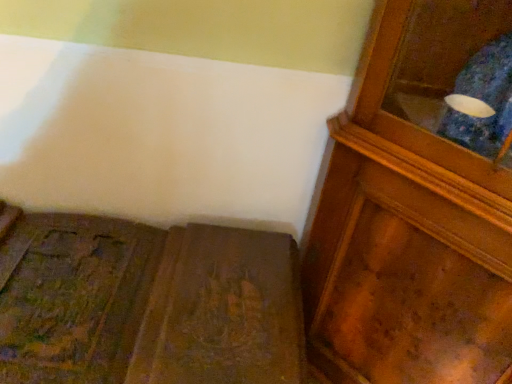
Describe the element at coordinates (146, 303) in the screenshot. The width and height of the screenshot is (512, 384). I see `wooden carved bench at lower left` at that location.

Image resolution: width=512 pixels, height=384 pixels. Find the location of `wooden carved bench at lower left`. wooden carved bench at lower left is located at coordinates point(146,303).

What do you see at coordinates (418, 204) in the screenshot? I see `wooden cabinet at right` at bounding box center [418, 204].

Where is `wooden cabinet at right`? This screenshot has width=512, height=384. wooden cabinet at right is located at coordinates (418, 204).

The width and height of the screenshot is (512, 384). In order to click on wooden carved bench at lower left in this screenshot , I will do `click(146, 303)`.

Considering the positions of objects wooden carved bench at lower left and wooden cabinet at right in the image provided, who is more to the right, wooden carved bench at lower left or wooden cabinet at right?

wooden cabinet at right is more to the right.

Between wooden carved bench at lower left and wooden cabinet at right, which one is positioned behind?

wooden carved bench at lower left is more distant.

Considering the points (148, 236) and (330, 355), which point is behind, point (148, 236) or point (330, 355)?

The point (330, 355) is behind.

From the image's perspective, is wooden carved bench at lower left located above wooden cabinet at right?

No, from the image's perspective, wooden carved bench at lower left is not above wooden cabinet at right.

From a real-world perspective, is wooden carved bench at lower left located beneath wooden cabinet at right?

Yes, from a real-world perspective, wooden carved bench at lower left is beneath wooden cabinet at right.

Between wooden carved bench at lower left and wooden cabinet at right, which one has smaller width?

With smaller width is wooden cabinet at right.

Is wooden carved bench at lower left taller or shorter than wooden cabinet at right?

In the image, wooden carved bench at lower left appears to be shorter than wooden cabinet at right.

Who is smaller, wooden carved bench at lower left or wooden cabinet at right?

Smaller between the two is wooden carved bench at lower left.

Do you think wooden carved bench at lower left is within wooden cabinet at right, or outside of it?

wooden carved bench at lower left is not enclosed by wooden cabinet at right.

Is wooden carved bench at lower left placed right next to wooden cabinet at right?

No, wooden carved bench at lower left is not beside wooden cabinet at right.

Is wooden carved bench at lower left positioned with its back to wooden cabinet at right?

wooden carved bench at lower left is not turned away from wooden cabinet at right.

What's the angular difference between wooden carved bench at lower left and wooden cabinet at right's facing directions?

The facing directions of wooden carved bench at lower left and wooden cabinet at right are 44.8 degrees apart.

How much distance is there between wooden carved bench at lower left and wooden cabinet at right?

The distance of wooden carved bench at lower left from wooden cabinet at right is 35.90 centimeters.

Find the location of `cupboard located above the wooden carved bench at lower left (from a real-world perspective)`. cupboard located above the wooden carved bench at lower left (from a real-world perspective) is located at coordinates (418, 204).

Between wooden cabinet at right and wooden carved bench at lower left, which one appears on the left side from the viewer's perspective?

wooden carved bench at lower left is more to the left.

Looking at this image, is wooden cabinet at right behind wooden carved bench at lower left?

No, the depth of wooden cabinet at right is less than that of wooden carved bench at lower left.

Which point is more forward, (x=464, y=318) or (x=227, y=231)?

The point (x=464, y=318) is closer.

From the image's perspective, is wooden cabinet at right above wooden carved bench at lower left?

Correct, wooden cabinet at right appears higher than wooden carved bench at lower left in the image.

From a real-world perspective, between wooden cabinet at right and wooden carved bench at lower left, who is vertically higher?

In real-world perspective, wooden cabinet at right is above.

Is wooden cabinet at right thinner than wooden carved bench at lower left?

Yes, wooden cabinet at right is thinner than wooden carved bench at lower left.

From their relative heights in the image, would you say wooden cabinet at right is taller or shorter than wooden carved bench at lower left?

Considering their sizes, wooden cabinet at right has more height than wooden carved bench at lower left.

Who is smaller, wooden cabinet at right or wooden carved bench at lower left?

wooden carved bench at lower left is smaller.

Looking at this image, is wooden cabinet at right located outside wooden carved bench at lower left?

Yes.

Are wooden cabinet at right and wooden carved bench at lower left located far from each other?

No, wooden cabinet at right is not far away from wooden carved bench at lower left.

Is wooden cabinet at right aimed at wooden carved bench at lower left?

No, wooden cabinet at right is not aimed at wooden carved bench at lower left.

In the image, there is a wooden carved bench at lower left. Find the location of `cupboard above it (from the image's perspective)`. cupboard above it (from the image's perspective) is located at coordinates (418, 204).

This screenshot has height=384, width=512. Find the location of `cupboard on the right side of wooden carved bench at lower left`. cupboard on the right side of wooden carved bench at lower left is located at coordinates (418, 204).

At what (x,y) coordinates should I click in order to perform the action: click on cupboard above the wooden carved bench at lower left (from the image's perspective). Please return your answer as a coordinate pair (x, y). Image resolution: width=512 pixels, height=384 pixels. Looking at the image, I should click on (418, 204).